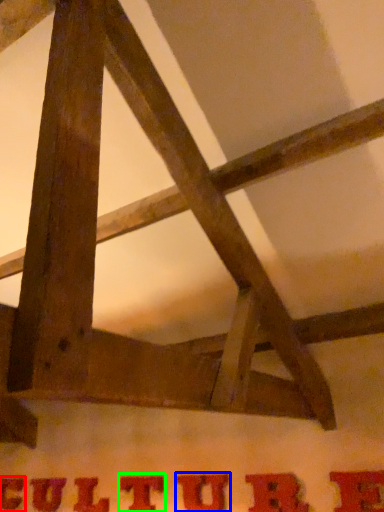
Question: Which is farther away from letter (highlighted by a red box)? letter (highlighted by a blue box) or letter (highlighted by a green box)?

Choices:
 (A) letter
 (B) letter

Answer: (A)